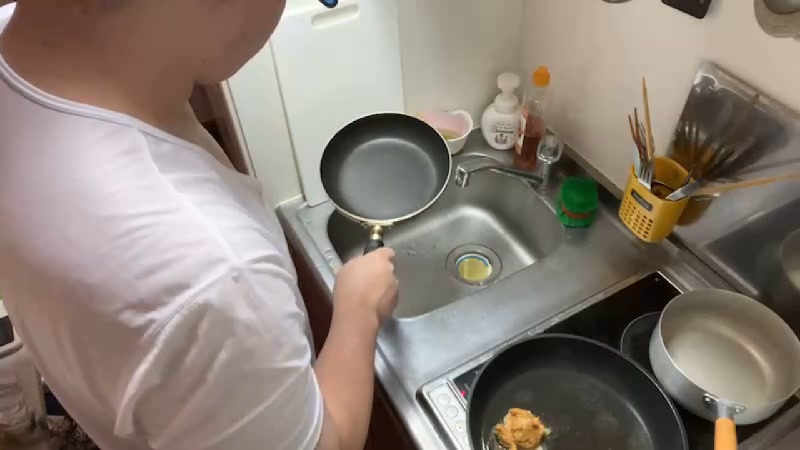
Image resolution: width=800 pixels, height=450 pixels. I want to click on sink, so click(441, 359).